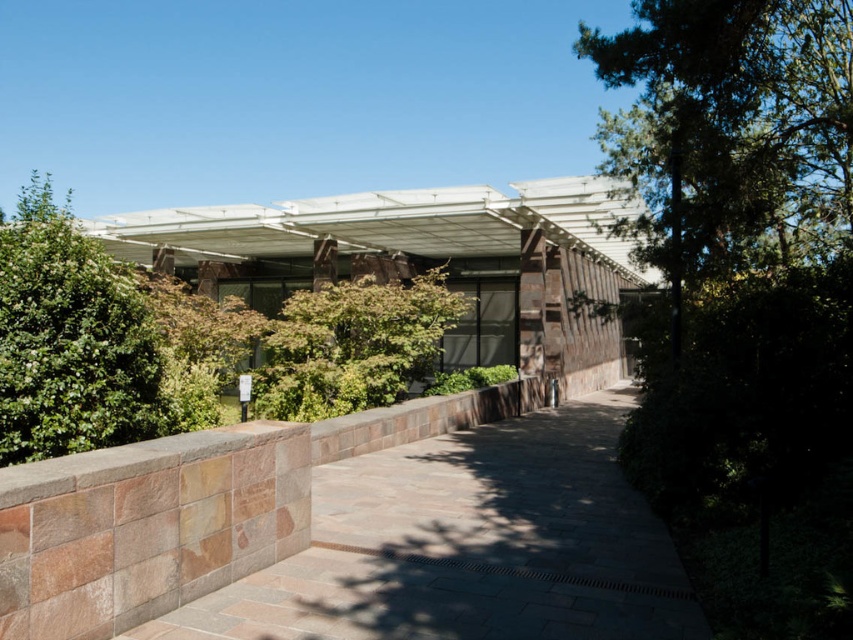
You are a visitor approaching the entrance of the building and see the brown stone path at center and the green leafy bush at left. Which object is positioned to the right side of the other?

The brown stone path at center is to the right of green leafy bush at left.

You are a landscape architect designing a garden path. You have two plants to place along the walkway in front of the building. The green leafy bush at left and the green leafy tree at center. Which plant has a wider spread and would require more space between them?

The green leafy bush at left has a larger width than the green leafy tree at center, so it requires more space between them.